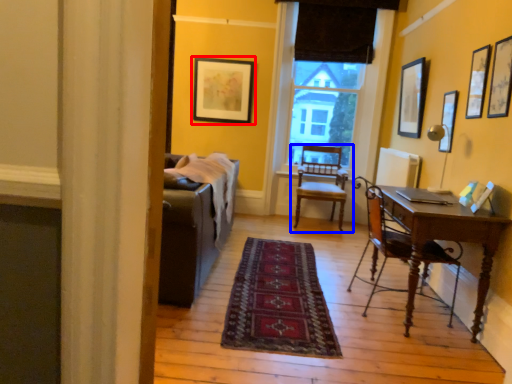
Question: Among these objects, which one is farthest to the camera, picture frame (highlighted by a red box) or chair (highlighted by a blue box)?

Choices:
 (A) picture frame
 (B) chair

Answer: (A)